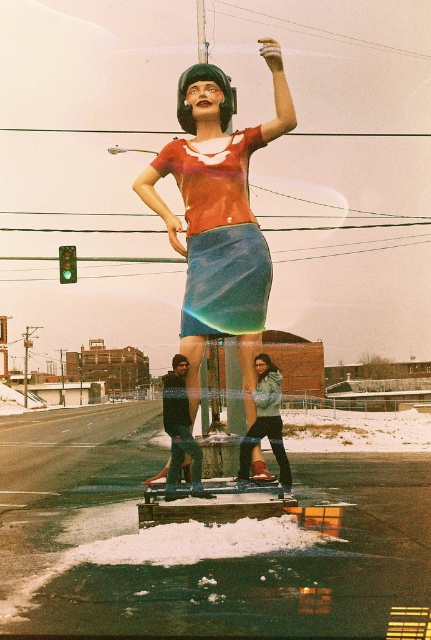
Question: Does matte red blouse at center appear on the right side of light blue denim skirt at center?

Choices:
 (A) yes
 (B) no

Answer: (B)

Question: Does light blue denim skirt at center appear over green glass traffic light at left?

Choices:
 (A) no
 (B) yes

Answer: (A)

Question: Can you confirm if matte red blouse at center is positioned to the left of denim skirt at center?

Choices:
 (A) no
 (B) yes

Answer: (B)

Question: Which of the following is the closest to the observer?

Choices:
 (A) denim skirt at center
 (B) matte red blouse at center
 (C) green glass traffic light at left

Answer: (B)

Question: Considering the real-world distances, which object is closest to the dark blue jeans at center?

Choices:
 (A) denim skirt at center
 (B) matte red blouse at center
 (C) light blue denim skirt at center

Answer: (C)

Question: Estimate the real-world distances between objects in this image. Which object is closer to the green glass traffic light at left?

Choices:
 (A) dark blue jeans at center
 (B) matte red blouse at center
 (C) light blue denim skirt at center

Answer: (A)